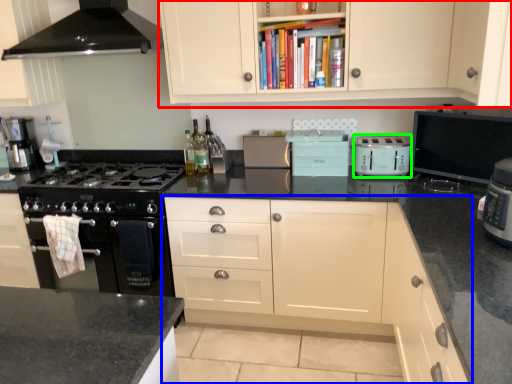
Question: Which object is positioned farthest from cabinetry (highlighted by a red box)? Select from cabinetry (highlighted by a blue box) and kitchen appliance (highlighted by a green box).

Choices:
 (A) cabinetry
 (B) kitchen appliance

Answer: (A)